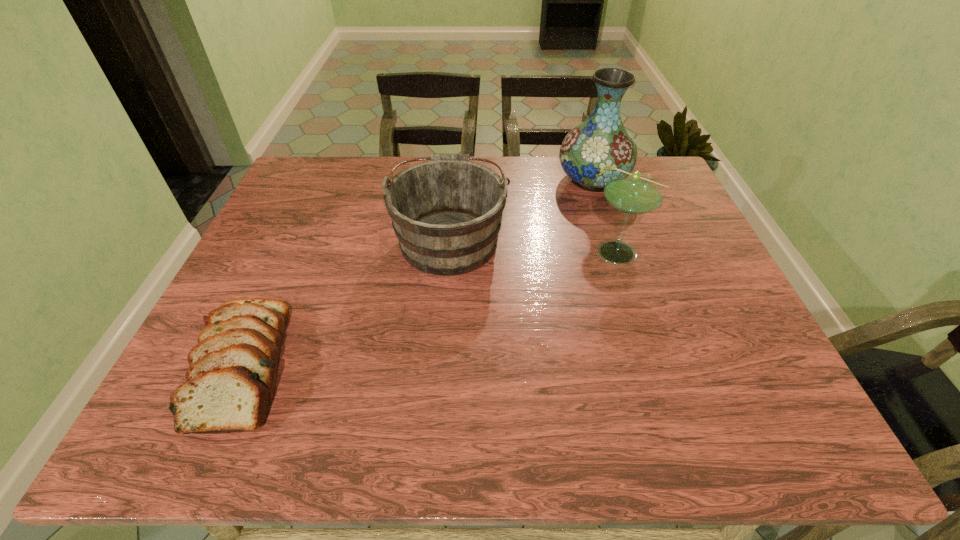
At what (x,y) coordinates should I click in order to perform the action: click on vacant area at the right edge. Please return your answer as a coordinate pair (x, y). Looking at the image, I should click on (735, 393).

Locate an element on the screen. The width and height of the screenshot is (960, 540). blank space at the far left corner of the desktop is located at coordinates (301, 166).

Where is `empty space that is in between the vase and the martini`? The image size is (960, 540). empty space that is in between the vase and the martini is located at coordinates (607, 215).

I want to click on empty space that is in between the bread and the wine bucket, so click(x=347, y=302).

Find the location of a particular element. vacant point located between the bread and the farthest object is located at coordinates (419, 272).

I want to click on free space between the farthest object and the martini, so click(607, 215).

The image size is (960, 540). I want to click on empty space that is in between the farthest object and the martini, so click(x=607, y=215).

Identify the location of unoccupied area between the second object from left to right and the farthest object. This screenshot has height=540, width=960. (521, 210).

Where is `unoccupied area between the second object from left to right and the farthest object`? unoccupied area between the second object from left to right and the farthest object is located at coordinates (521, 210).

Identify the location of free space between the martini and the second object from left to right. The width and height of the screenshot is (960, 540). (535, 245).